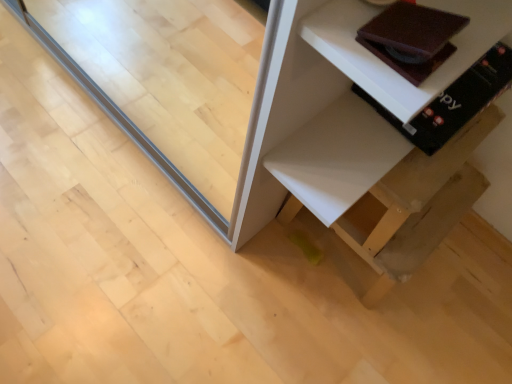
Question: Considering the relative sizes of transparent glass door at center and matte brown book at upper right, which appears as the second book when viewed from the back, in the image provided, is transparent glass door at center thinner than matte brown book at upper right, which appears as the second book when viewed from the back,?

Choices:
 (A) yes
 (B) no

Answer: (A)

Question: Could you tell me if transparent glass door at center is turned towards matte brown book at upper right, which appears as the 1th book when viewed from the front?

Choices:
 (A) yes
 (B) no

Answer: (B)

Question: Does transparent glass door at center have a larger size compared to matte brown book at upper right, which appears as the second book when viewed from the back?

Choices:
 (A) yes
 (B) no

Answer: (A)

Question: From the image's perspective, would you say transparent glass door at center is positioned over matte brown book at upper right, which appears as the 1th book when viewed from the front?

Choices:
 (A) yes
 (B) no

Answer: (A)

Question: From the image's perspective, would you say transparent glass door at center is shown under matte brown book at upper right, which appears as the second book when viewed from the back?

Choices:
 (A) yes
 (B) no

Answer: (B)

Question: Can you confirm if transparent glass door at center is shorter than matte brown book at upper right, which appears as the 1th book when viewed from the front?

Choices:
 (A) yes
 (B) no

Answer: (B)

Question: Does transparent glass door at center have a larger size compared to brown leather book at upper right, the 2th book viewed from the front?

Choices:
 (A) no
 (B) yes

Answer: (B)

Question: Is transparent glass door at center at the right side of brown leather book at upper right, the 2th book viewed from the front?

Choices:
 (A) no
 (B) yes

Answer: (A)

Question: Is brown leather book at upper right, placed as the 1th book when sorted from back to front, a part of transparent glass door at center?

Choices:
 (A) no
 (B) yes

Answer: (A)

Question: Is transparent glass door at center located outside brown leather book at upper right, the 2th book viewed from the front?

Choices:
 (A) no
 (B) yes

Answer: (B)

Question: Are transparent glass door at center and brown leather book at upper right, placed as the 1th book when sorted from back to front, beside each other?

Choices:
 (A) no
 (B) yes

Answer: (A)

Question: Is transparent glass door at center positioned far away from brown leather book at upper right, placed as the 1th book when sorted from back to front?

Choices:
 (A) yes
 (B) no

Answer: (B)

Question: Is white matte shelf at lower right located outside brown leather book at upper right, placed as the 1th book when sorted from back to front?

Choices:
 (A) no
 (B) yes

Answer: (B)